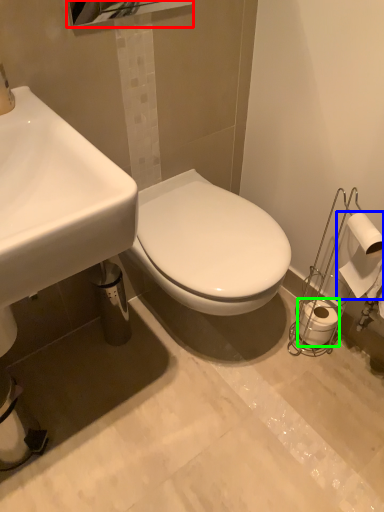
Question: Estimate the real-world distances between objects in this image. Which object is farther from mirror (highlighted by a red box), toilet paper (highlighted by a blue box) or toilet paper (highlighted by a green box)?

Choices:
 (A) toilet paper
 (B) toilet paper

Answer: (B)